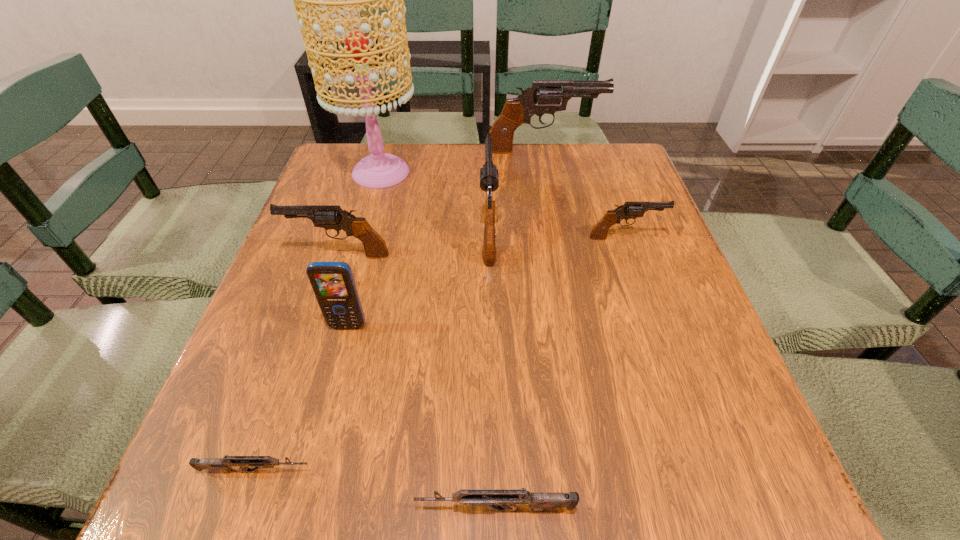
At what (x,y) coordinates should I click in order to perform the action: click on vacant space at the near edge of the desktop. Please return your answer as a coordinate pair (x, y). The height and width of the screenshot is (540, 960). Looking at the image, I should click on (603, 457).

Find the location of a particular element. free space at the left edge is located at coordinates (306, 201).

Image resolution: width=960 pixels, height=540 pixels. I want to click on free location at the right edge of the desktop, so click(x=640, y=394).

Where is `free space at the far left corner of the desktop`? The image size is (960, 540). free space at the far left corner of the desktop is located at coordinates (341, 180).

This screenshot has height=540, width=960. In the image, there is a desktop. Identify the location of free space at the near left corner. (259, 485).

Locate an element on the screen. blank space at the far right corner of the desktop is located at coordinates (577, 152).

Where is `free space between the smallest black gun and the fifth shortest gun`? free space between the smallest black gun and the fifth shortest gun is located at coordinates (557, 232).

Find the location of `free spot between the lampshade and the third shortest object`. free spot between the lampshade and the third shortest object is located at coordinates (503, 205).

You are a GUI agent. You are given a task and a screenshot of the screen. Output one action in this format:
    pyautogui.click(x=<x>, y=<y>)
    Task: Click on the vacant area that lies between the farthest gun and the smaller grey gun
    The height and width of the screenshot is (540, 960).
    Given the screenshot: What is the action you would take?
    pyautogui.click(x=400, y=310)

In order to click on vacant space that is in between the smallest black gun and the lampshade in this screenshot , I will do `click(503, 205)`.